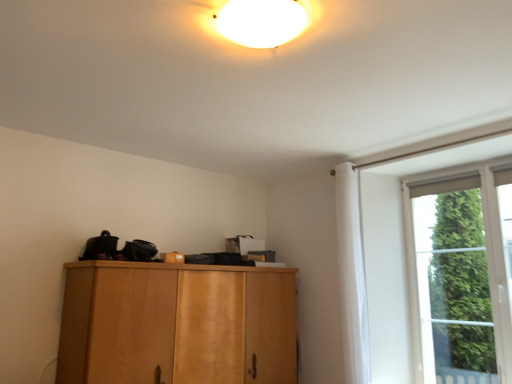
Measure the distance between point (152, 309) and camera.

They are 2.92 meters apart.

What do you see at coordinates (453, 283) in the screenshot?
I see `green glass window at right` at bounding box center [453, 283].

What are the coordinates of `white fabric curtain at right` in the screenshot? It's located at (351, 275).

Considering the sizes of white fabric curtain at right and light brown wood cabinet at center in the image, is white fabric curtain at right bigger or smaller than light brown wood cabinet at center?

Clearly, white fabric curtain at right is smaller in size than light brown wood cabinet at center.

Can you tell me how much white fabric curtain at right and light brown wood cabinet at center differ in facing direction?

The angle between the facing direction of white fabric curtain at right and the facing direction of light brown wood cabinet at center is 90.7 degrees.

Does white fabric curtain at right have a lesser width compared to light brown wood cabinet at center?

Yes, white fabric curtain at right is thinner than light brown wood cabinet at center.

Is white fabric curtain at right placed right next to light brown wood cabinet at center?

white fabric curtain at right and light brown wood cabinet at center are not in contact.

How much distance is there between light brown wood cabinet at center and green glass window at right?

light brown wood cabinet at center and green glass window at right are 6.81 feet apart from each other.

Is light brown wood cabinet at center outside of green glass window at right?

Yes, light brown wood cabinet at center is located beyond the bounds of green glass window at right.

Is point (104, 313) closer or farther from the camera than point (481, 223)?

Clearly, point (104, 313) is closer to the camera than point (481, 223).

From their relative heights in the image, would you say light brown wood cabinet at center is taller or shorter than green glass window at right?

Considering their sizes, light brown wood cabinet at center has less height than green glass window at right.

From the image's perspective, who appears lower, white fabric curtain at right or green glass window at right?

green glass window at right is shown below in the image.

Can you confirm if white fabric curtain at right is shorter than green glass window at right?

Incorrect, the height of white fabric curtain at right does not fall short of that of green glass window at right.

From the picture: Is white fabric curtain at right oriented away from green glass window at right?

No, green glass window at right is not at the back of white fabric curtain at right.

Can you see light brown wood cabinet at center touching white fabric curtain at right?

light brown wood cabinet at center and white fabric curtain at right are not in contact.

Would you say light brown wood cabinet at center is inside or outside white fabric curtain at right?

The correct answer is: outside.

Does light brown wood cabinet at center come in front of white fabric curtain at right?

Yes.

Find the location of a particular element. Image resolution: width=512 pixels, height=384 pixels. cabinetry that is on the left side of white fabric curtain at right is located at coordinates (177, 324).

Measure the distance between green glass window at right and white fabric curtain at right.

green glass window at right is 3.97 feet from white fabric curtain at right.

Is green glass window at right located outside white fabric curtain at right?

Yes, green glass window at right is outside of white fabric curtain at right.

From a real-world perspective, which is physically below, green glass window at right or white fabric curtain at right?

From a 3D spatial view, green glass window at right is below.

Is green glass window at right turned away from white fabric curtain at right?

That's not correct — green glass window at right is not looking away from white fabric curtain at right.

Between green glass window at right and light brown wood cabinet at center, which one has smaller size?

green glass window at right is smaller.

Which is in front, green glass window at right or light brown wood cabinet at center?

light brown wood cabinet at center is in front.

Is green glass window at right spatially inside light brown wood cabinet at center, or outside of it?

The correct answer is: outside.

Where is `cabinetry located below the green glass window at right (from the image's perspective)`? This screenshot has height=384, width=512. cabinetry located below the green glass window at right (from the image's perspective) is located at coordinates (177, 324).

Where is `cabinetry below the white fabric curtain at right (from the image's perspective)`? The width and height of the screenshot is (512, 384). cabinetry below the white fabric curtain at right (from the image's perspective) is located at coordinates tap(177, 324).

Where is `window above the light brown wood cabinet at center (from the image's perspective)`? window above the light brown wood cabinet at center (from the image's perspective) is located at coordinates (453, 283).

Which object lies further to the anchor point green glass window at right, white fabric curtain at right or light brown wood cabinet at center?

Based on the image, light brown wood cabinet at center appears to be further to green glass window at right.

Looking at the image, which one is located further to white fabric curtain at right, light brown wood cabinet at center or green glass window at right?

green glass window at right is further to white fabric curtain at right.

Estimate the real-world distances between objects in this image. Which object is closer to white fabric curtain at right, green glass window at right or light brown wood cabinet at center?

The object closer to white fabric curtain at right is light brown wood cabinet at center.

From the image, which object appears to be farther from green glass window at right, light brown wood cabinet at center or white fabric curtain at right?

The object further to green glass window at right is light brown wood cabinet at center.

Which object lies nearer to the anchor point light brown wood cabinet at center, white fabric curtain at right or green glass window at right?

The object closer to light brown wood cabinet at center is white fabric curtain at right.

From the picture: Looking at the image, which one is located further to light brown wood cabinet at center, green glass window at right or white fabric curtain at right?

Based on the image, green glass window at right appears to be further to light brown wood cabinet at center.

At what (x,y) coordinates should I click in order to perform the action: click on curtain situated between light brown wood cabinet at center and green glass window at right from left to right. Please return your answer as a coordinate pair (x, y). The width and height of the screenshot is (512, 384). Looking at the image, I should click on (351, 275).